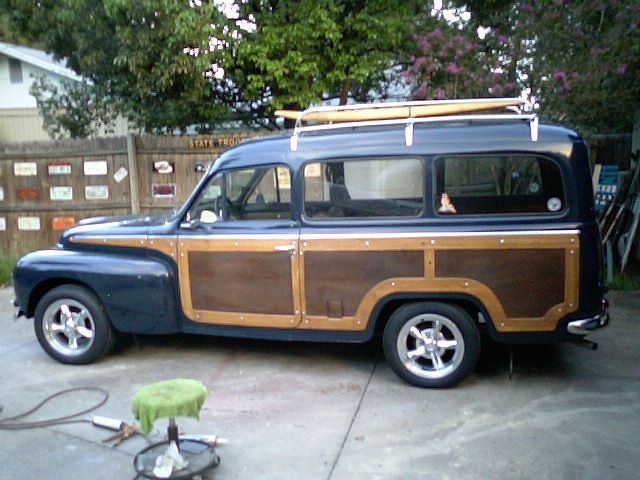
Locate an element on the screen. The image size is (640, 480). sticker is located at coordinates (556, 208).